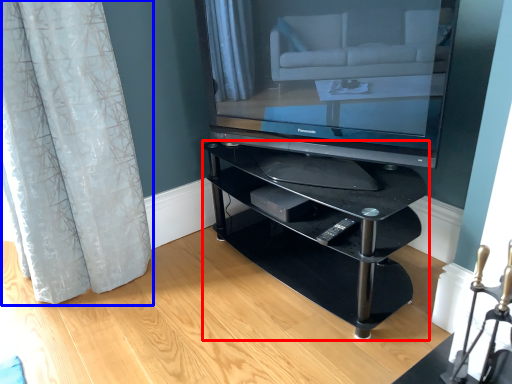
Question: Which point is closer to the camera, shelf (highlighted by a red box) or curtain (highlighted by a blue box)?

Choices:
 (A) shelf
 (B) curtain

Answer: (B)